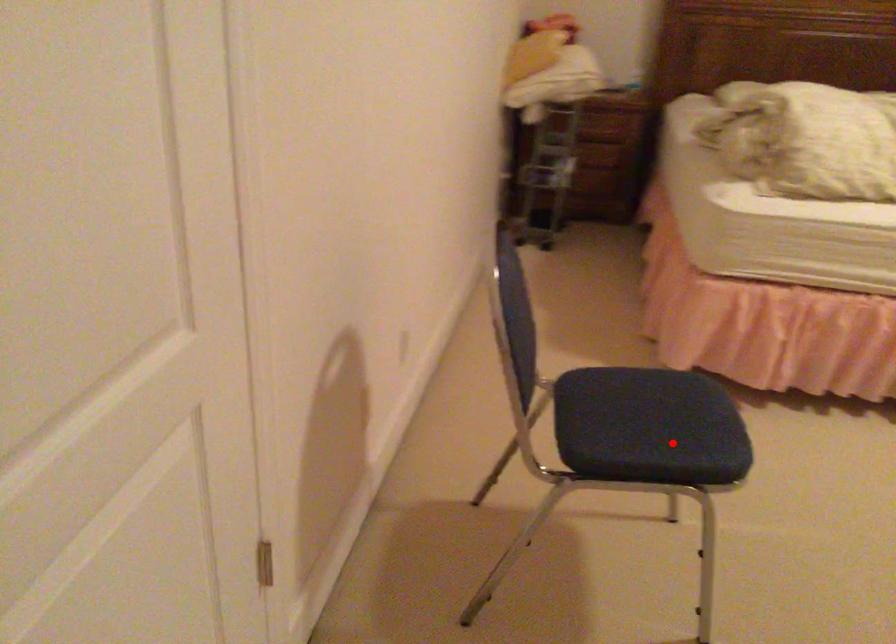
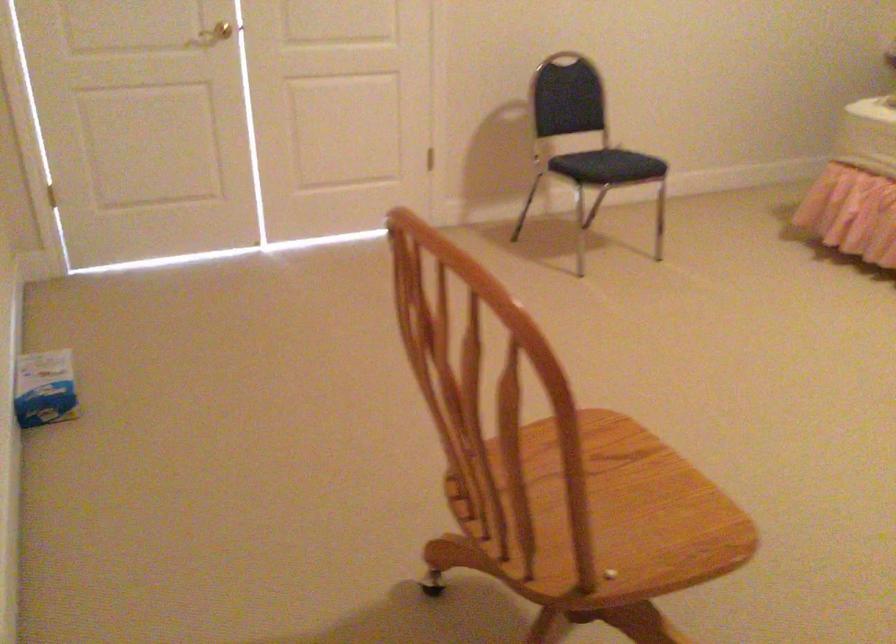
Question: I am providing you with two images of the same scene from different viewpoints. Image1 has a red point marked. In image2, the corresponding 3D location appears at what relative position? Reply with the corresponding letter.

Choices:
 (A) Closer
 (B) Farther

Answer: (B)